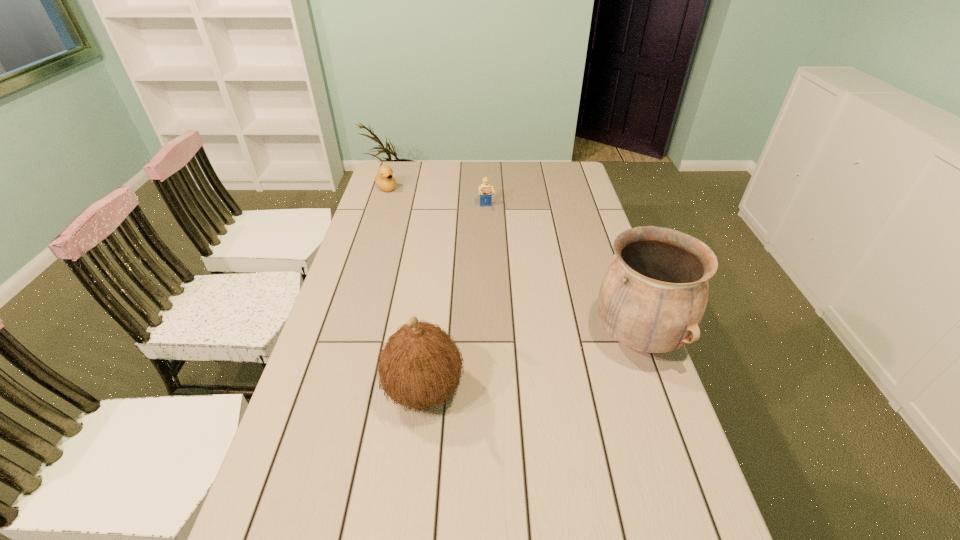
I want to click on free space on the desktop that is between the coconut and the rightmost object and is positioned on the face of the second farthest object, so click(x=524, y=366).

Locate an element on the screen. The width and height of the screenshot is (960, 540). free spot on the desktop that is between the third object from right to left and the urn and is positioned facing forward on the leftmost object is located at coordinates (556, 357).